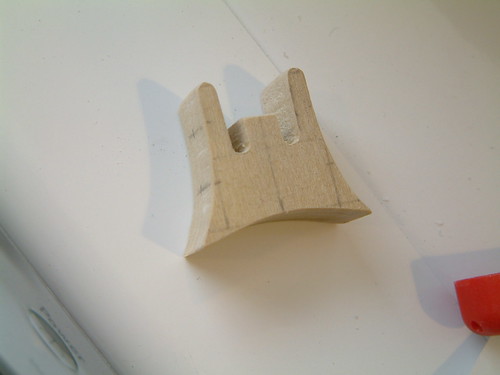
Identify the location of drawer. (56, 319).